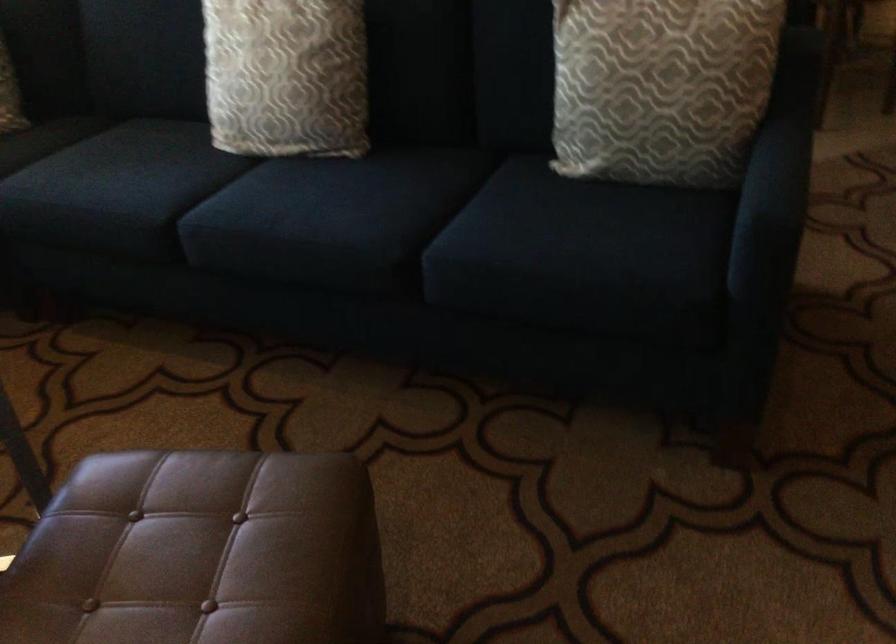
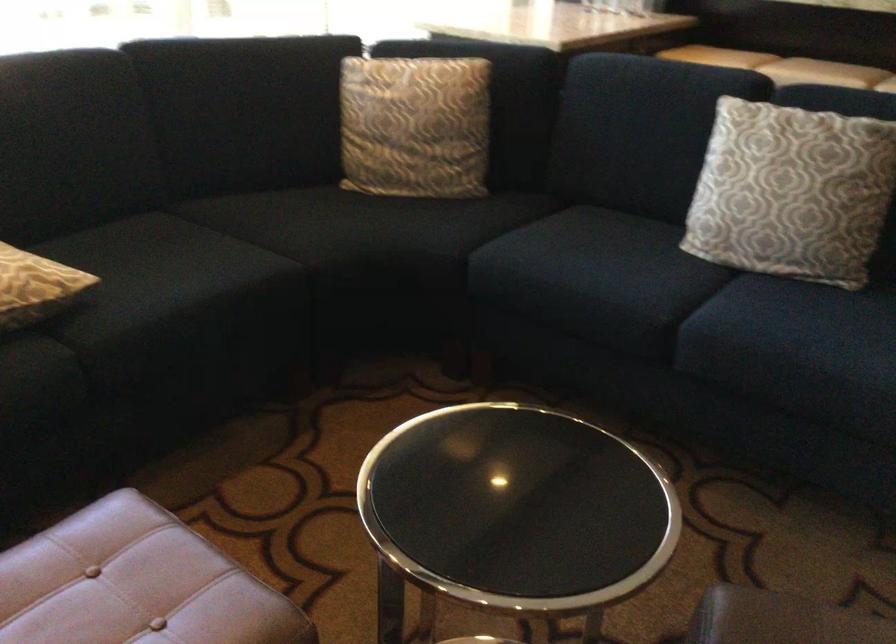
Locate, in the second image, the point that corresponds to point 280,71 in the first image.

(791, 192)